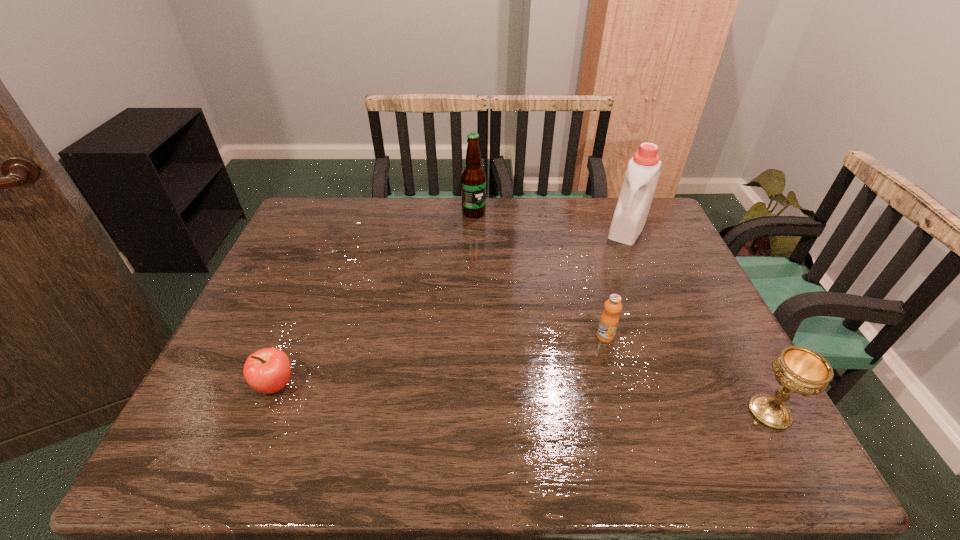
Where is `vacant space at the near edge`? vacant space at the near edge is located at coordinates (635, 387).

I want to click on vacant space at the left edge of the desktop, so 266,305.

Find the location of `free region at the right edge`. free region at the right edge is located at coordinates (668, 349).

In order to click on vacant position at the near right corner of the desktop in this screenshot , I will do `click(730, 392)`.

Image resolution: width=960 pixels, height=540 pixels. Identify the location of free space that is in between the second object from right to left and the leftmost object. (451, 307).

Where is `free space between the fourth object from right to left and the apple`? free space between the fourth object from right to left and the apple is located at coordinates (374, 299).

Find the location of a particular element. vacant area that lies between the third object from right to left and the rightmost object is located at coordinates (687, 375).

Where is `vacant region between the detergent and the shortest object`? The image size is (960, 540). vacant region between the detergent and the shortest object is located at coordinates coord(451,307).

This screenshot has width=960, height=540. Identify the location of unoccupied area between the apple and the rightmost object. (522, 399).

You are a GUI agent. You are given a task and a screenshot of the screen. Output one action in this format:
    pyautogui.click(x=<x>, y=<y>)
    Task: Click on the free spot between the shortest object and the beer bottle
    
    Given the screenshot: What is the action you would take?
    pyautogui.click(x=374, y=299)